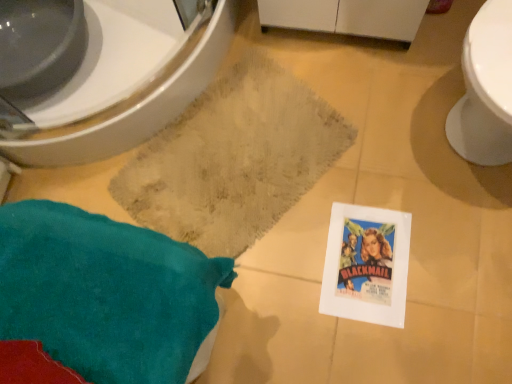
Question: Is the position of beige textured bath mat at center more distant than that of white glossy bidet at upper left?

Choices:
 (A) no
 (B) yes

Answer: (B)

Question: Is beige textured bath mat at center at the left side of white glossy bidet at upper left?

Choices:
 (A) yes
 (B) no

Answer: (B)

Question: Considering the relative sizes of beige textured bath mat at center and white glossy bidet at upper left in the image provided, is beige textured bath mat at center bigger than white glossy bidet at upper left?

Choices:
 (A) no
 (B) yes

Answer: (A)

Question: Is beige textured bath mat at center in contact with white glossy bidet at upper left?

Choices:
 (A) no
 (B) yes

Answer: (A)

Question: Does beige textured bath mat at center have a lesser height compared to white glossy bidet at upper left?

Choices:
 (A) yes
 (B) no

Answer: (A)

Question: In terms of width, does white glossy bidet at upper left look wider or thinner when compared to beige textured bath mat at center?

Choices:
 (A) thin
 (B) wide

Answer: (B)

Question: Visually, is white glossy bidet at upper left positioned to the left or to the right of beige textured bath mat at center?

Choices:
 (A) right
 (B) left

Answer: (B)

Question: In terms of height, does white glossy bidet at upper left look taller or shorter compared to beige textured bath mat at center?

Choices:
 (A) tall
 (B) short

Answer: (A)

Question: From a real-world perspective, is white glossy bidet at upper left above or below beige textured bath mat at center?

Choices:
 (A) below
 (B) above

Answer: (B)

Question: Is teal fabric throw pillow at lower left to the left or to the right of white glossy bidet at upper left in the image?

Choices:
 (A) right
 (B) left

Answer: (A)

Question: In terms of height, does teal fabric throw pillow at lower left look taller or shorter compared to white glossy bidet at upper left?

Choices:
 (A) short
 (B) tall

Answer: (B)

Question: Is teal fabric throw pillow at lower left bigger or smaller than white glossy bidet at upper left?

Choices:
 (A) small
 (B) big

Answer: (A)

Question: Is teal fabric throw pillow at lower left inside the boundaries of white glossy bidet at upper left, or outside?

Choices:
 (A) outside
 (B) inside

Answer: (A)

Question: Is beige textured bath mat at center spatially inside teal fabric throw pillow at lower left, or outside of it?

Choices:
 (A) inside
 (B) outside

Answer: (B)

Question: From a real-world perspective, is beige textured bath mat at center positioned above or below teal fabric throw pillow at lower left?

Choices:
 (A) below
 (B) above

Answer: (A)